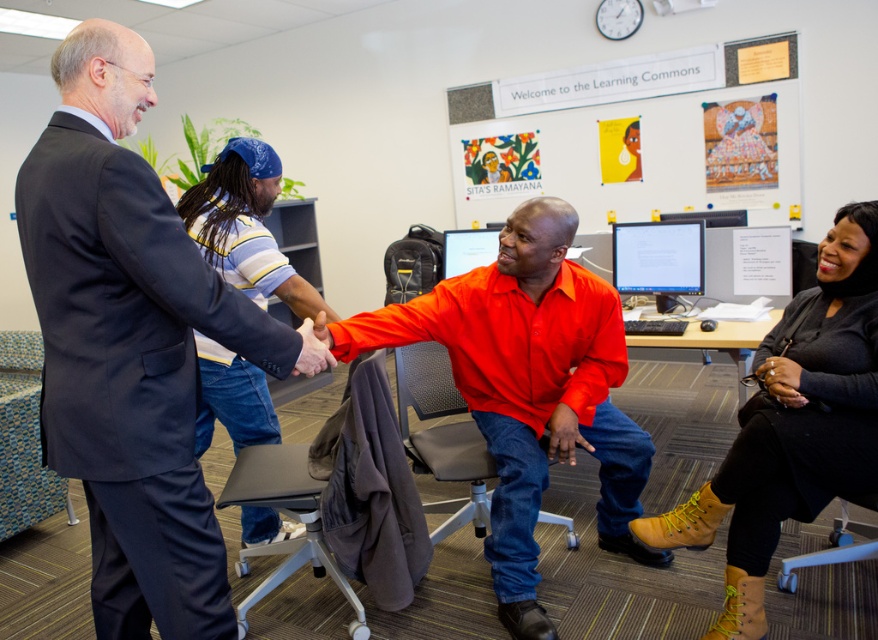
Who is higher up, dark blue suit at left or matte black monitor at center?

matte black monitor at center

The image size is (878, 640). I want to click on dark blue suit at left, so click(131, 346).

Between dark blue suit at left and matte orange shirt at center, which one appears on the left side from the viewer's perspective?

Positioned to the left is dark blue suit at left.

Identify the location of dark blue suit at left. The height and width of the screenshot is (640, 878). (131, 346).

Who is more forward, (527, 301) or (639, 284)?

Point (527, 301)

Based on the photo, is matte orange shirt at center positioned in front of matte black monitor at center?

Yes, matte orange shirt at center is in front of matte black monitor at center.

Which is in front, point (610, 536) or point (634, 237)?

Point (610, 536) is more forward.

I want to click on matte orange shirt at center, so click(529, 388).